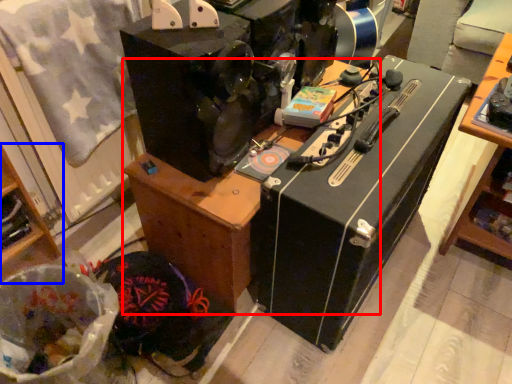
Question: Among these objects, which one is nearest to the camera, furniture (highlighted by a red box) or furniture (highlighted by a blue box)?

Choices:
 (A) furniture
 (B) furniture

Answer: (B)